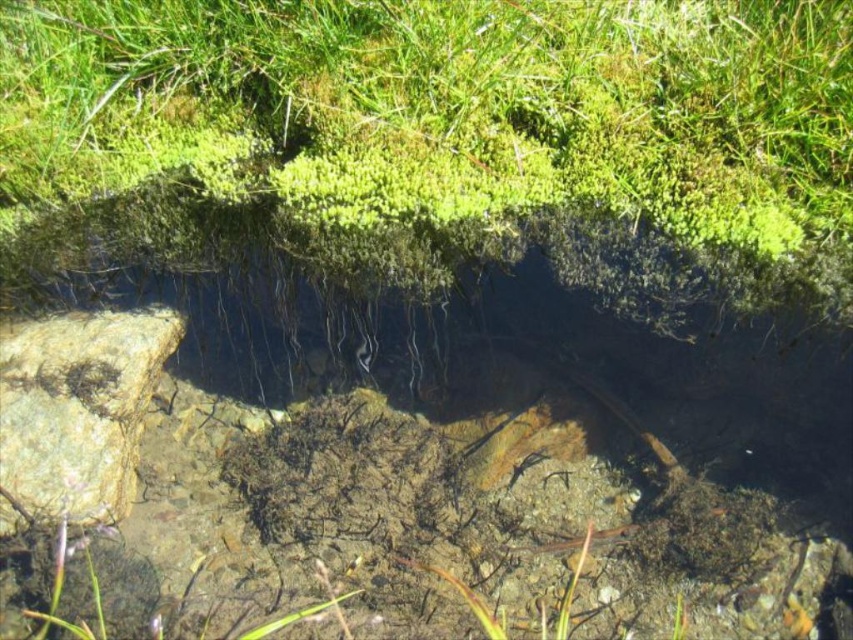
You are planning to place a small garden statue that is 1 meter wide in this natural setting. You want to place it where there is enough space. Which location would be suitable between the green mossy grass at upper center and the rough textured rock at left?

The green mossy grass at upper center has a larger width than the rough textured rock at left, so placing the statue there would provide sufficient space.

You are a hiker trying to cross the water body. You see the green mossy grass at upper center and the rough textured rock at left. Which object should you step on to avoid slipping?

You should step on the rough textured rock at left because it has a better grip compared to the green mossy grass at upper center, which is slippery.